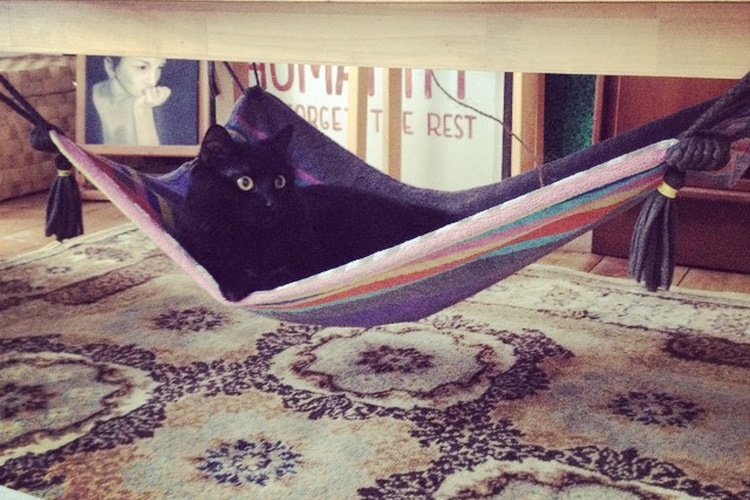
Find the location of `frame`. frame is located at coordinates (81, 107).